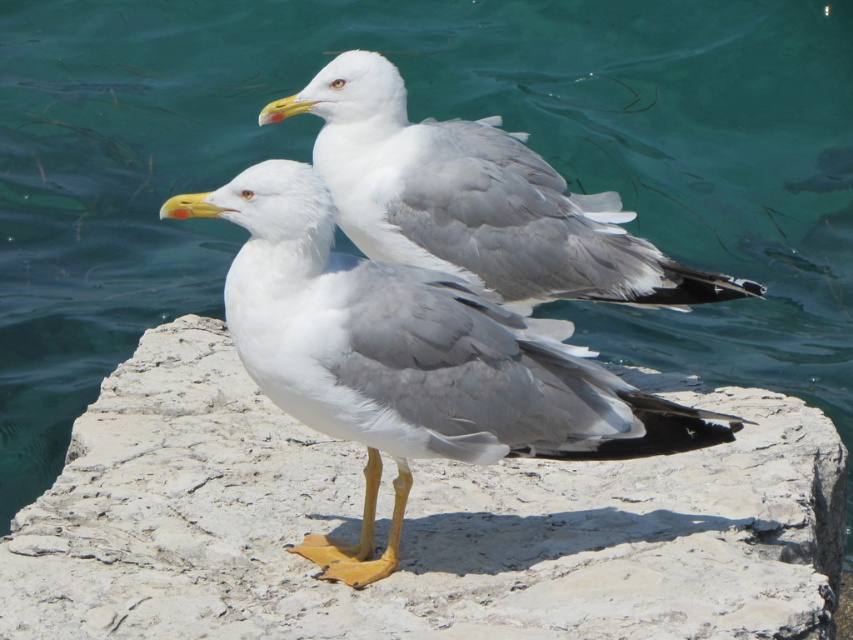
Which is in front, point (408, 301) or point (576, 209)?

Point (408, 301) is in front.

Who is positioned more to the left, white feathered seagull at center or white matte seagull at center?

Positioned to the left is white feathered seagull at center.

At what (x,y) coordinates should I click in order to perform the action: click on white feathered seagull at center. Please return your answer as a coordinate pair (x, y). This screenshot has height=640, width=853. Looking at the image, I should click on (398, 355).

Between white stone at center and white matte seagull at center, which one appears on the left side from the viewer's perspective?

white stone at center

Is white stone at center smaller than white matte seagull at center?

Incorrect, white stone at center is not smaller in size than white matte seagull at center.

Image resolution: width=853 pixels, height=640 pixels. What do you see at coordinates (415, 524) in the screenshot? I see `white stone at center` at bounding box center [415, 524].

The width and height of the screenshot is (853, 640). Identify the location of white stone at center. (415, 524).

Which is in front, point (213, 362) or point (421, 307)?

Positioned in front is point (421, 307).

Who is more distant from viewer, (798, 480) or (308, 216)?

Point (798, 480)

The height and width of the screenshot is (640, 853). I want to click on white stone at center, so click(x=415, y=524).